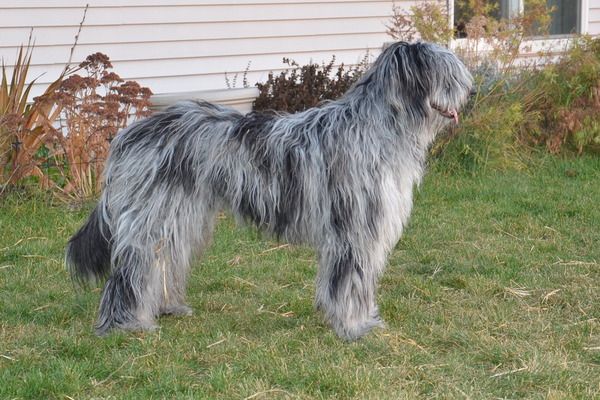
Where is `window`? window is located at coordinates (554, 18), (464, 10).